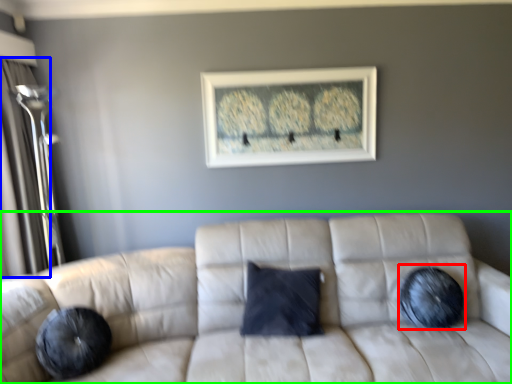
Question: Estimate the real-world distances between objects in this image. Which object is farther from pillow (highlighted by a red box), glass door (highlighted by a blue box) or studio couch (highlighted by a green box)?

Choices:
 (A) glass door
 (B) studio couch

Answer: (A)